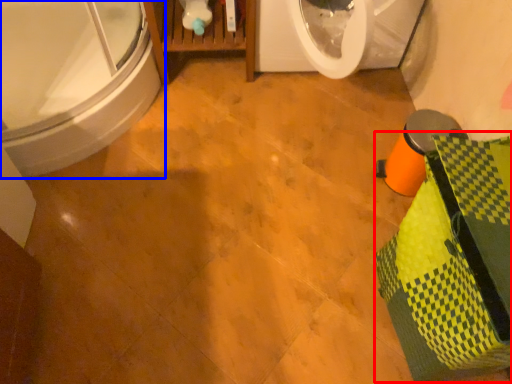
Question: Which of the following is the farthest to the observer, material (highlighted by a red box) or bathtub (highlighted by a blue box)?

Choices:
 (A) material
 (B) bathtub

Answer: (B)